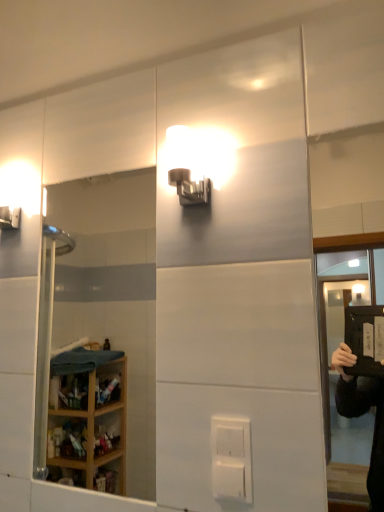
Question: Is point (137, 266) closer or farther from the camera than point (236, 458)?

Choices:
 (A) farther
 (B) closer

Answer: (A)

Question: From the image's perspective, is clear glass mirror at left positioned above or below white plastic electric outlet at center?

Choices:
 (A) below
 (B) above

Answer: (B)

Question: Which object is positioned farthest from the clear glass mirror at left?

Choices:
 (A) transparent plastic screen door at upper right
 (B) matte white sconce at upper center
 (C) white plastic electric outlet at center

Answer: (C)

Question: Which object is the farthest from the white plastic electric outlet at center?

Choices:
 (A) matte white sconce at upper center
 (B) transparent plastic screen door at upper right
 (C) clear glass mirror at left

Answer: (B)